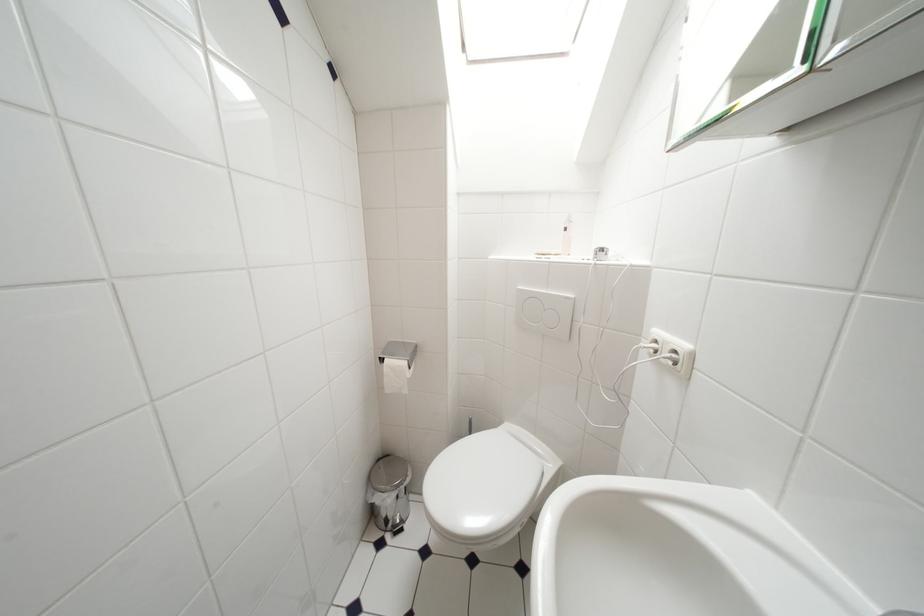
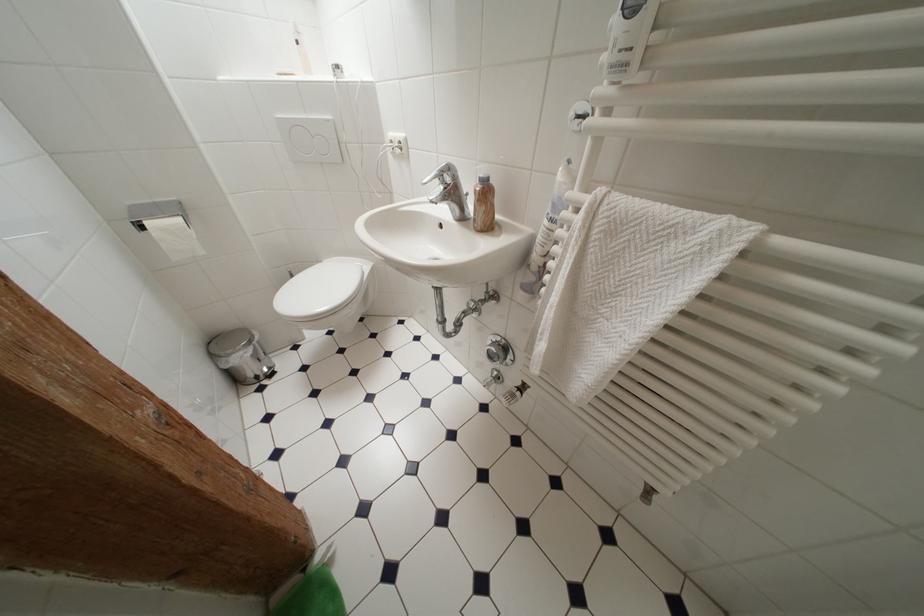
In the second image, find the point that corresponds to pixel 392 498 in the first image.

(249, 355)